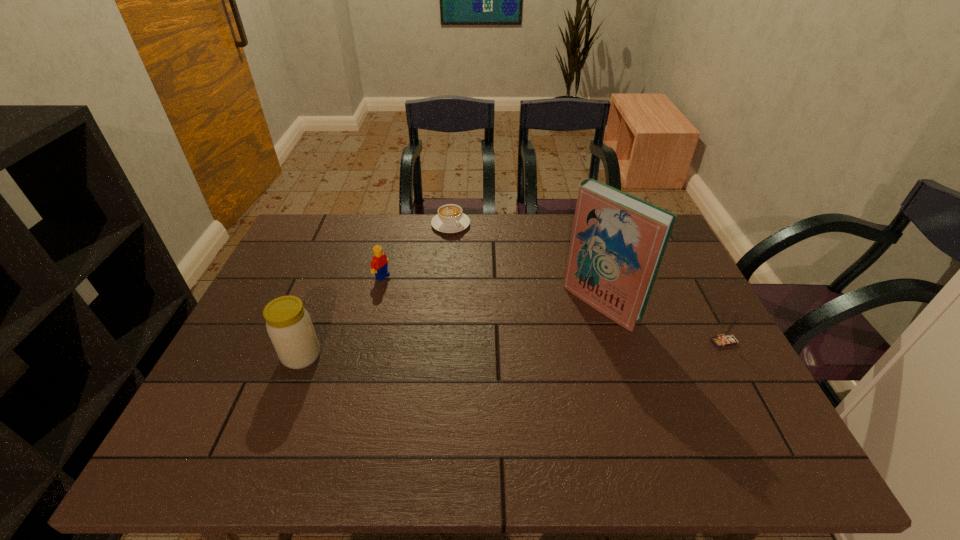
Locate an element on the screen. vacant space on the desktop that is between the jar and the rightmost object and is positioned on the face of the second object from left to right is located at coordinates (528, 348).

Where is `free space on the desktop that is between the fourth shortest object and the rightmost object and is positioned on the side of the cappuccino with the handle`? The height and width of the screenshot is (540, 960). free space on the desktop that is between the fourth shortest object and the rightmost object and is positioned on the side of the cappuccino with the handle is located at coordinates (551, 347).

This screenshot has width=960, height=540. I want to click on free space on the desktop that is between the jar and the rightmost object and is positioned on the cover of the hardback book, so click(545, 347).